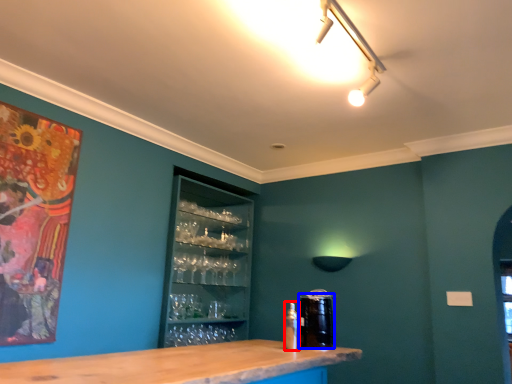
Question: Among these objects, which one is nearest to the camera, bottle (highlighted by a red box) or beverage (highlighted by a blue box)?

Choices:
 (A) bottle
 (B) beverage

Answer: (A)